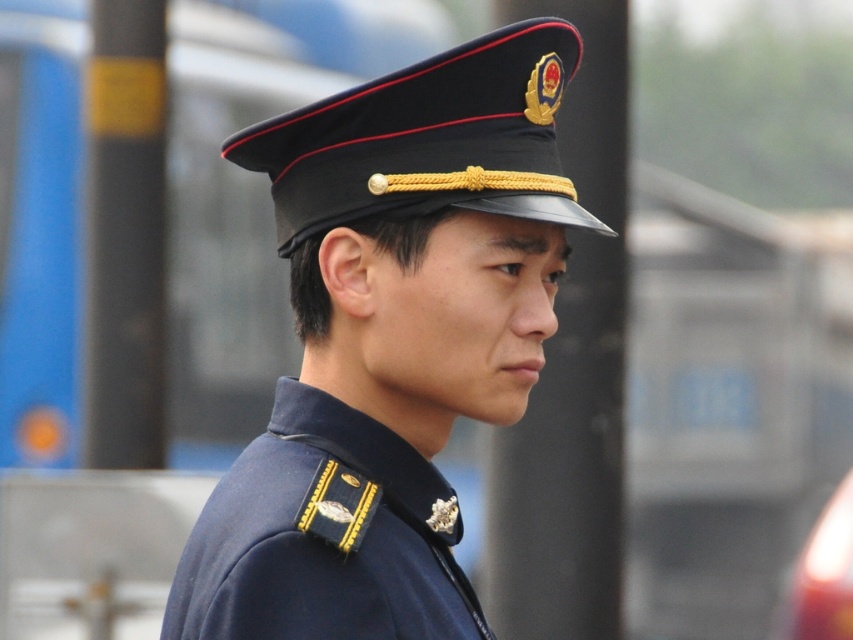
Does navy blue uniform at center have a greater height compared to navy blue fabric at center?

Correct, navy blue uniform at center is much taller as navy blue fabric at center.

This screenshot has height=640, width=853. Identify the location of navy blue uniform at center. [x=390, y=340].